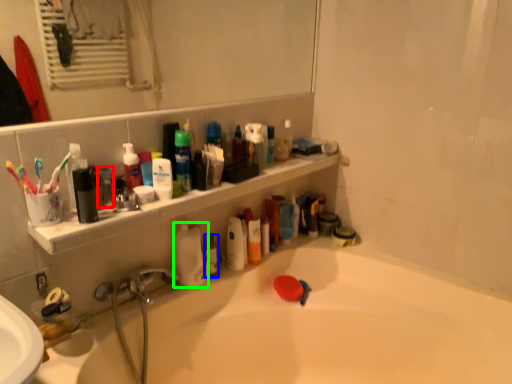
Question: Which is nearer to the mouthwash (highlighted by a red box)? mouthwash (highlighted by a blue box) or cleaning product (highlighted by a green box).

Choices:
 (A) mouthwash
 (B) cleaning product

Answer: (B)